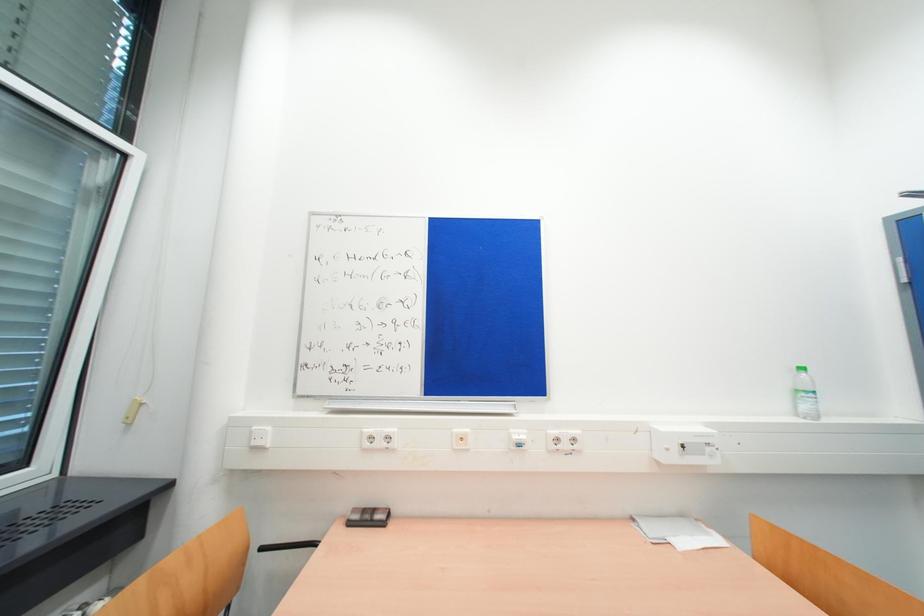
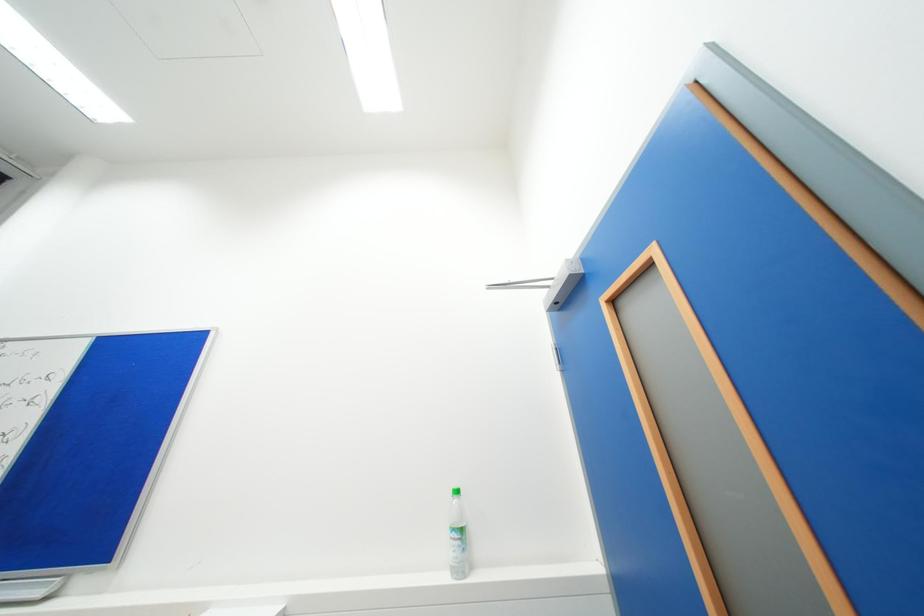
Question: Which direction would the cameraman need to move to produce the second image? Reply with the corresponding letter.

Choices:
 (A) Left
 (B) Right
 (C) Forward
 (D) Backward

Answer: (B)